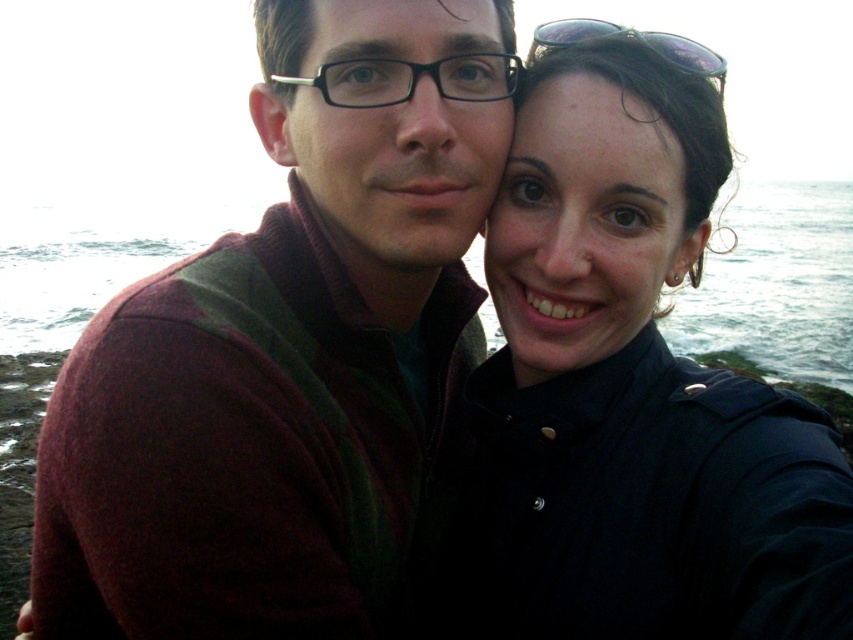
You are a photographer trying to capture a clear shot of the matte black shirt at center without the maroon sweater at left blocking it. What adjustment should you make to your camera angle?

Since the matte black shirt at center is behind the maroon sweater at left, you should adjust your camera angle to move it behind the maroon sweater at left so that the matte black shirt at center becomes visible.

You are a photographer trying to capture a group photo of the maroon sweater at left and the matte black shirt at center. Which object should you focus on to ensure it takes up more of the frame?

The matte black shirt at center should be focused on because it occupies more space than the maroon sweater at left.

You are trying to decide which clothing item to grab quickly from your bag. You see the maroon sweater at left and the matte black shirt at center in your bag. Which one is closer to the left side of your bag?

The maroon sweater at left is to the left of matte black shirt at center, so the maroon sweater at left is closer to the left side of your bag.